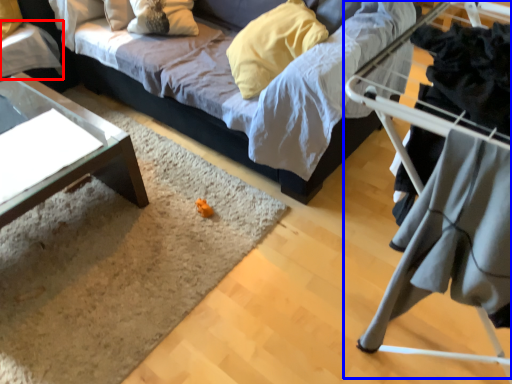
Question: Which object is closer to the camera taking this photo, table (highlighted by a red box) or bunk bed (highlighted by a blue box)?

Choices:
 (A) table
 (B) bunk bed

Answer: (B)